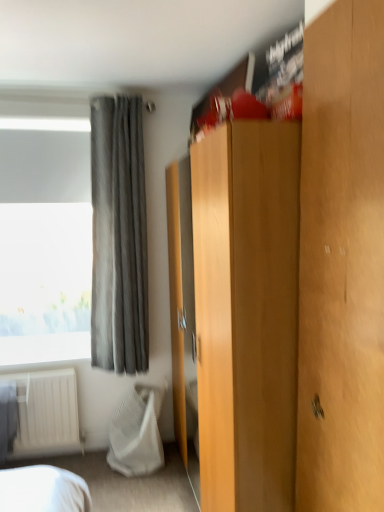
Question: From the image's perspective, is white textured blanket at lower left beneath wooden door at right?

Choices:
 (A) yes
 (B) no

Answer: (A)

Question: Is white textured blanket at lower left placed right next to wooden door at right?

Choices:
 (A) no
 (B) yes

Answer: (A)

Question: Would you say white textured blanket at lower left is outside wooden door at right?

Choices:
 (A) no
 (B) yes

Answer: (B)

Question: From a real-world perspective, does white textured blanket at lower left sit lower than wooden door at right?

Choices:
 (A) no
 (B) yes

Answer: (B)

Question: Does white textured blanket at lower left lie behind wooden door at right?

Choices:
 (A) yes
 (B) no

Answer: (A)

Question: Is white textured blanket at lower left looking in the opposite direction of wooden door at right?

Choices:
 (A) no
 (B) yes

Answer: (A)

Question: Can you confirm if wooden door at right is positioned to the left of light brown wood dresser at center?

Choices:
 (A) no
 (B) yes

Answer: (A)

Question: Can you confirm if wooden door at right is wider than light brown wood dresser at center?

Choices:
 (A) no
 (B) yes

Answer: (A)

Question: Can you confirm if wooden door at right is smaller than light brown wood dresser at center?

Choices:
 (A) yes
 (B) no

Answer: (A)

Question: Would you consider wooden door at right to be distant from light brown wood dresser at center?

Choices:
 (A) no
 (B) yes

Answer: (A)

Question: Is the position of wooden door at right more distant than that of light brown wood dresser at center?

Choices:
 (A) no
 (B) yes

Answer: (A)

Question: Is wooden door at right facing away from light brown wood dresser at center?

Choices:
 (A) no
 (B) yes

Answer: (A)

Question: Is wooden door at right bigger than gray fabric curtain at upper left?

Choices:
 (A) yes
 (B) no

Answer: (B)